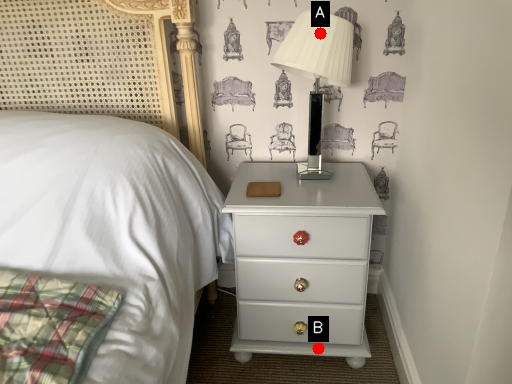
Question: Two points are circled on the image, labeled by A and B beside each circle. Which point is closer to the camera taking this photo?

Choices:
 (A) A is closer
 (B) B is closer

Answer: (A)